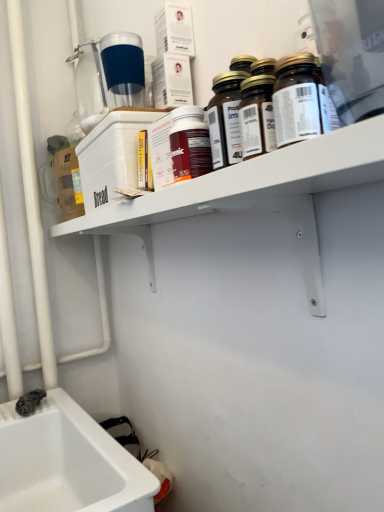
Question: Would you say transparent plastic bottle at upper center, positioned as the fifth bottle in front-to-back order, is outside white plastic shelf at upper center?

Choices:
 (A) yes
 (B) no

Answer: (A)

Question: Is transparent plastic bottle at upper center, marked as the first bottle in a back-to-front arrangement, touching white plastic shelf at upper center?

Choices:
 (A) no
 (B) yes

Answer: (A)

Question: Does transparent plastic bottle at upper center, marked as the first bottle in a back-to-front arrangement, have a greater width compared to white plastic shelf at upper center?

Choices:
 (A) yes
 (B) no

Answer: (B)

Question: Does transparent plastic bottle at upper center, positioned as the fifth bottle in front-to-back order, come behind white plastic shelf at upper center?

Choices:
 (A) yes
 (B) no

Answer: (A)

Question: Is transparent plastic bottle at upper center, marked as the first bottle in a back-to-front arrangement, bigger than white plastic shelf at upper center?

Choices:
 (A) no
 (B) yes

Answer: (A)

Question: Is matte plastic bottle at center, which is the fourth bottle from front to back, inside the boundaries of transparent plastic bottle at upper center, positioned as the fifth bottle in front-to-back order, or outside?

Choices:
 (A) inside
 (B) outside

Answer: (B)

Question: From the image's perspective, is matte plastic bottle at center, which ranks as the 2th bottle in back-to-front order, above or below transparent plastic bottle at upper center, positioned as the fifth bottle in front-to-back order?

Choices:
 (A) below
 (B) above

Answer: (A)

Question: From a real-world perspective, is matte plastic bottle at center, which ranks as the 2th bottle in back-to-front order, positioned above or below transparent plastic bottle at upper center, positioned as the fifth bottle in front-to-back order?

Choices:
 (A) below
 (B) above

Answer: (A)

Question: Is matte plastic bottle at center, which ranks as the 2th bottle in back-to-front order, wider or thinner than transparent plastic bottle at upper center, positioned as the fifth bottle in front-to-back order?

Choices:
 (A) thin
 (B) wide

Answer: (A)

Question: Do you think white plastic shelf at upper center is within brown glass bottle at upper center, arranged as the first bottle when viewed from the front, or outside of it?

Choices:
 (A) inside
 (B) outside

Answer: (B)

Question: Visually, is white plastic shelf at upper center positioned to the left or to the right of brown glass bottle at upper center, arranged as the first bottle when viewed from the front?

Choices:
 (A) left
 (B) right

Answer: (A)

Question: Does point (208, 174) appear closer or farther from the camera than point (281, 76)?

Choices:
 (A) farther
 (B) closer

Answer: (A)

Question: From the image's perspective, is white plastic shelf at upper center positioned above or below brown glass bottle at upper center, arranged as the first bottle when viewed from the front?

Choices:
 (A) below
 (B) above

Answer: (A)

Question: Is translucent glass bottles at upper right, which is the third bottle from front to back, inside or outside of matte plastic bottle at center, which is the fourth bottle from front to back?

Choices:
 (A) inside
 (B) outside

Answer: (B)

Question: Considering the positions of translucent glass bottles at upper right, which ranks as the 3th bottle in back-to-front order, and matte plastic bottle at center, which ranks as the 2th bottle in back-to-front order, in the image, is translucent glass bottles at upper right, which ranks as the 3th bottle in back-to-front order, wider or thinner than matte plastic bottle at center, which ranks as the 2th bottle in back-to-front order,?

Choices:
 (A) wide
 (B) thin

Answer: (B)